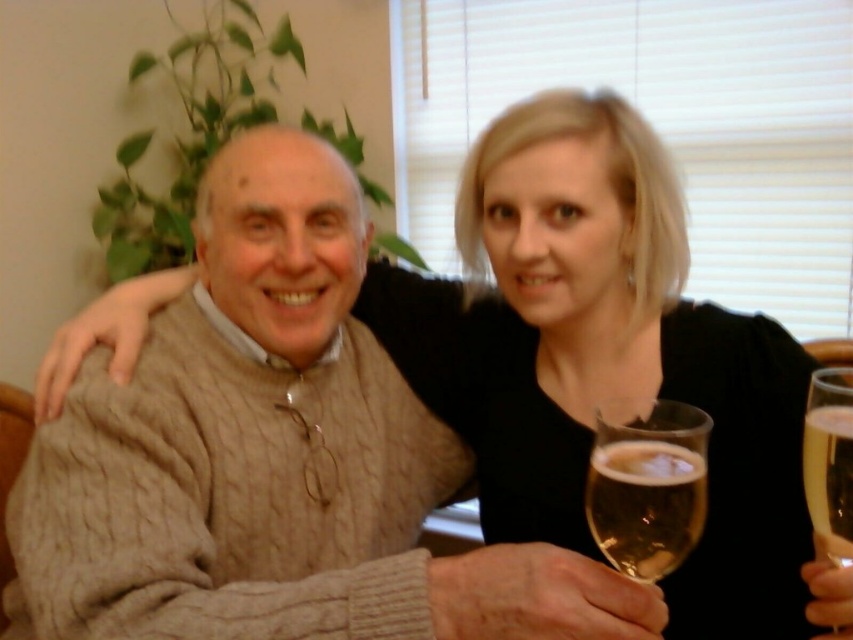
You are at a party and want to choose a glass for your sparkling drink. Which glass has a smaller width, the translucent glass at lower right or the clear glass wine glass at right?

The translucent glass at lower right has a lesser width compared to the clear glass wine glass at right, so the translucent glass at lower right is the smaller one.

You are a bartender at a party and need to place two glasses on a shelf. The shelf is only 4 inches wide. You have a translucent glass at lower right and a clear glass wine glass at right. Can both glasses fit side by side on the shelf without overlapping?

The distance between the translucent glass at lower right and clear glass wine glass at right is 4.66 inches. Since the shelf is only 4 inches wide, the glasses cannot fit side by side without overlapping because 4.66 inches exceeds the shelf width of 4 inches.

You are at a social gathering and see the translucent glass at lower right. Can you tell me its exact location in the image using coordinates?

The translucent glass at lower right is located at point (645, 504).